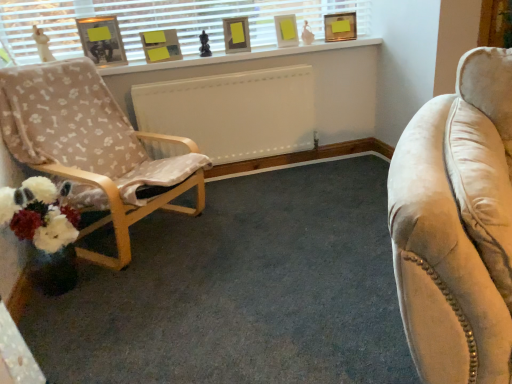
At what (x,y) coordinates should I click in order to perform the action: click on white matte window sill at upper center. Please return your answer as a coordinate pair (x, y). Image resolution: width=512 pixels, height=384 pixels. Looking at the image, I should click on (161, 22).

What do you see at coordinates (340, 27) in the screenshot?
I see `matte gold picture frame at upper center, positioned as the first picture frame in right-to-left order` at bounding box center [340, 27].

In order to click on matte gold picture frame at upper center, positioned as the first picture frame in right-to-left order in this screenshot , I will do tap(340, 27).

You are a GUI agent. You are given a task and a screenshot of the screen. Output one action in this format:
    pyautogui.click(x=<x>, y=<y>)
    Task: Click on the white painted wood at upper center
    The height and width of the screenshot is (384, 512).
    Given the screenshot: What is the action you would take?
    pyautogui.click(x=237, y=56)

Locate an element on the screen. Image resolution: width=512 pixels, height=384 pixels. matte black picture frame at upper left, the fifth picture frame in the right-to-left sequence is located at coordinates (102, 40).

Locate an element on the screen. Image resolution: width=512 pixels, height=384 pixels. white matte window sill at upper center is located at coordinates (161, 22).

From a real-world perspective, between matte gold picture frame at upper center, acting as the 5th picture frame starting from the left, and white matte window sill at upper center, who is vertically lower?

In real-world perspective, matte gold picture frame at upper center, acting as the 5th picture frame starting from the left, is lower.

Between point (334, 35) and point (47, 1), which one is positioned in front?

The point (47, 1) is more forward.

From the image's perspective, is matte gold picture frame at upper center, acting as the 5th picture frame starting from the left, over white matte window sill at upper center?

Yes, from the image's perspective, matte gold picture frame at upper center, acting as the 5th picture frame starting from the left, is over white matte window sill at upper center.

Is matte gold picture frame at upper center, acting as the 5th picture frame starting from the left, facing towards white matte window sill at upper center?

No, matte gold picture frame at upper center, acting as the 5th picture frame starting from the left, does not turn towards white matte window sill at upper center.

Considering the sizes of objects white painted wood at upper center and matte white picture frame at upper center, arranged as the second picture frame when viewed from the right, in the image provided, who is bigger, white painted wood at upper center or matte white picture frame at upper center, arranged as the second picture frame when viewed from the right,?

white painted wood at upper center is bigger.

Is white painted wood at upper center closer to camera compared to matte white picture frame at upper center, arranged as the second picture frame when viewed from the right?

Yes, white painted wood at upper center is closer to the camera.

From a real-world perspective, is white painted wood at upper center physically located above or below matte white picture frame at upper center, marked as the 4th picture frame in a left-to-right arrangement?

In terms of real-world spatial position, white painted wood at upper center is below matte white picture frame at upper center, marked as the 4th picture frame in a left-to-right arrangement.

You are a GUI agent. You are given a task and a screenshot of the screen. Output one action in this format:
    pyautogui.click(x=<x>, y=<y>)
    Task: Click on the window sill in front of the matte white picture frame at upper center, marked as the 4th picture frame in a left-to-right arrangement
    This screenshot has width=512, height=384.
    Given the screenshot: What is the action you would take?
    pyautogui.click(x=237, y=56)

How different are the orientations of white painted wood at upper center and matte gray picture frame at upper center, which is counted as the 3th picture frame, starting from the right, in degrees?

17.3 degrees.

Which is behind, white painted wood at upper center or matte gray picture frame at upper center, acting as the 3th picture frame starting from the left?

matte gray picture frame at upper center, acting as the 3th picture frame starting from the left, is behind.

Considering the points (374, 40) and (229, 22), which point is in front, point (374, 40) or point (229, 22)?

The point (229, 22) is closer to the camera.

Is white painted wood at upper center touching matte gray picture frame at upper center, acting as the 3th picture frame starting from the left?

No, white painted wood at upper center is not touching matte gray picture frame at upper center, acting as the 3th picture frame starting from the left.

In the scene shown: Can you tell me how much matte black picture frame at upper left, the first picture frame in the left-to-right sequence, and matte gray picture frame at upper center, acting as the 3th picture frame starting from the left, differ in facing direction?

matte black picture frame at upper left, the first picture frame in the left-to-right sequence, and matte gray picture frame at upper center, acting as the 3th picture frame starting from the left, are facing 25.1 degrees away from each other.

Would you consider matte black picture frame at upper left, the fifth picture frame in the right-to-left sequence, to be distant from matte gray picture frame at upper center, acting as the 3th picture frame starting from the left?

That's not correct — matte black picture frame at upper left, the fifth picture frame in the right-to-left sequence, is a little close to matte gray picture frame at upper center, acting as the 3th picture frame starting from the left.

Between matte black picture frame at upper left, the fifth picture frame in the right-to-left sequence, and matte gray picture frame at upper center, acting as the 3th picture frame starting from the left, which one has smaller width?

With smaller width is matte gray picture frame at upper center, acting as the 3th picture frame starting from the left.

There is a matte gray picture frame at upper center, which is counted as the 3th picture frame, starting from the right. At what (x,y) coordinates should I click in order to perform the action: click on picture frame above it (from a real-world perspective). Please return your answer as a coordinate pair (x, y). This screenshot has height=384, width=512. Looking at the image, I should click on (102, 40).

Is matte gold picture frame at upper center, acting as the 5th picture frame starting from the left, inside or outside of wooden chair with bone-patterned fabric at left?

matte gold picture frame at upper center, acting as the 5th picture frame starting from the left, is not inside wooden chair with bone-patterned fabric at left, it's outside.

Considering the positions of objects matte gold picture frame at upper center, positioned as the first picture frame in right-to-left order, and wooden chair with bone-patterned fabric at left in the image provided, who is in front, matte gold picture frame at upper center, positioned as the first picture frame in right-to-left order, or wooden chair with bone-patterned fabric at left?

wooden chair with bone-patterned fabric at left.

Which is in front, point (328, 36) or point (170, 167)?

Positioned in front is point (170, 167).

From the image's perspective, which is above, matte gold picture frame at upper center, acting as the 5th picture frame starting from the left, or wooden chair with bone-patterned fabric at left?

matte gold picture frame at upper center, acting as the 5th picture frame starting from the left, appears higher in the image.

Considering their positions, is wooden chair with bone-patterned fabric at left located in front of or behind matte black picture frame at upper left, the fifth picture frame in the right-to-left sequence?

In the image, wooden chair with bone-patterned fabric at left appears in front of matte black picture frame at upper left, the fifth picture frame in the right-to-left sequence.

The height and width of the screenshot is (384, 512). I want to click on chair below the matte black picture frame at upper left, the first picture frame in the left-to-right sequence (from a real-world perspective), so click(x=93, y=148).

Is wooden chair with bone-patterned fabric at left not inside matte black picture frame at upper left, the fifth picture frame in the right-to-left sequence?

Indeed, wooden chair with bone-patterned fabric at left is completely outside matte black picture frame at upper left, the fifth picture frame in the right-to-left sequence.

In the scene shown: From a real-world perspective, is wooden chair with bone-patterned fabric at left positioned over matte black picture frame at upper left, the first picture frame in the left-to-right sequence, based on gravity?

Actually, wooden chair with bone-patterned fabric at left is physically below matte black picture frame at upper left, the first picture frame in the left-to-right sequence, in the real world.

Find the location of `the 2nd picture frame counting from the right of the white painted wood at upper center`. the 2nd picture frame counting from the right of the white painted wood at upper center is located at coordinates [340, 27].

Which of these two, white painted wood at upper center or matte gold picture frame at upper center, positioned as the first picture frame in right-to-left order, stands taller?

Standing taller between the two is matte gold picture frame at upper center, positioned as the first picture frame in right-to-left order.

Measure the distance between white painted wood at upper center and matte gold picture frame at upper center, acting as the 5th picture frame starting from the left.

They are 14.11 inches apart.

Is white painted wood at upper center touching matte gold picture frame at upper center, acting as the 5th picture frame starting from the left?

No, white painted wood at upper center is not making contact with matte gold picture frame at upper center, acting as the 5th picture frame starting from the left.

In order to click on window lying in front of the matte gold picture frame at upper center, acting as the 5th picture frame starting from the left in this screenshot , I will do `click(161, 22)`.

Where is `window sill located below the matte white picture frame at upper center, marked as the 4th picture frame in a left-to-right arrangement (from the image's perspective)`? Image resolution: width=512 pixels, height=384 pixels. window sill located below the matte white picture frame at upper center, marked as the 4th picture frame in a left-to-right arrangement (from the image's perspective) is located at coordinates (237, 56).

Considering their positions, is matte gray picture frame at upper center, which is counted as the 3th picture frame, starting from the right, positioned further to matte black picture frame at upper left, the first picture frame in the left-to-right sequence, than matte cardboard picture frame at upper center, arranged as the second picture frame when viewed from the left?

Based on the image, matte gray picture frame at upper center, which is counted as the 3th picture frame, starting from the right, appears to be further to matte black picture frame at upper left, the first picture frame in the left-to-right sequence.

Considering their positions, is matte gray picture frame at upper center, which is counted as the 3th picture frame, starting from the right, positioned closer to matte black picture frame at upper left, the fifth picture frame in the right-to-left sequence, than white painted wood at upper center?

Based on the image, white painted wood at upper center appears to be nearer to matte black picture frame at upper left, the fifth picture frame in the right-to-left sequence.

Based on their spatial positions, is wooden chair with bone-patterned fabric at left or white painted wood at upper center closer to matte white picture frame at upper center, marked as the 4th picture frame in a left-to-right arrangement?

The object closer to matte white picture frame at upper center, marked as the 4th picture frame in a left-to-right arrangement, is white painted wood at upper center.

When comparing their distances from wooden chair with bone-patterned fabric at left, does matte gold picture frame at upper center, acting as the 5th picture frame starting from the left, or white painted wood at upper center seem further?

matte gold picture frame at upper center, acting as the 5th picture frame starting from the left, is positioned further to the anchor wooden chair with bone-patterned fabric at left.

When comparing their distances from matte black picture frame at upper left, the first picture frame in the left-to-right sequence, does white painted wood at upper center or matte gray picture frame at upper center, which is counted as the 3th picture frame, starting from the right, seem further?

matte gray picture frame at upper center, which is counted as the 3th picture frame, starting from the right, lies further to matte black picture frame at upper left, the first picture frame in the left-to-right sequence, than the other object.

When comparing their distances from matte black picture frame at upper left, the fifth picture frame in the right-to-left sequence, does matte gold picture frame at upper center, positioned as the first picture frame in right-to-left order, or white matte window sill at upper center seem closer?

The object closer to matte black picture frame at upper left, the fifth picture frame in the right-to-left sequence, is white matte window sill at upper center.

From the image, which object appears to be farther from white matte window sill at upper center, matte black picture frame at upper left, the first picture frame in the left-to-right sequence, or matte gold picture frame at upper center, acting as the 5th picture frame starting from the left?

Based on the image, matte gold picture frame at upper center, acting as the 5th picture frame starting from the left, appears to be further to white matte window sill at upper center.

When comparing their distances from matte black picture frame at upper left, the first picture frame in the left-to-right sequence, does matte white picture frame at upper center, arranged as the second picture frame when viewed from the right, or white painted wood at upper center seem further?

matte white picture frame at upper center, arranged as the second picture frame when viewed from the right.

The image size is (512, 384). Find the location of `window between wooden chair with bone-patterned fabric at left and matte gold picture frame at upper center, positioned as the first picture frame in right-to-left order, in the front-back direction`. window between wooden chair with bone-patterned fabric at left and matte gold picture frame at upper center, positioned as the first picture frame in right-to-left order, in the front-back direction is located at coordinates (161, 22).

Where is `window sill between matte cardboard picture frame at upper center, arranged as the second picture frame when viewed from the left, and matte white picture frame at upper center, marked as the 4th picture frame in a left-to-right arrangement`? The height and width of the screenshot is (384, 512). window sill between matte cardboard picture frame at upper center, arranged as the second picture frame when viewed from the left, and matte white picture frame at upper center, marked as the 4th picture frame in a left-to-right arrangement is located at coordinates (237, 56).

Locate an element on the screen. The width and height of the screenshot is (512, 384). window located between wooden chair with bone-patterned fabric at left and matte cardboard picture frame at upper center, the 4th picture frame from the right, in the depth direction is located at coordinates pos(161,22).

The image size is (512, 384). Find the location of `window situated between matte cardboard picture frame at upper center, arranged as the second picture frame when viewed from the left, and white painted wood at upper center from left to right`. window situated between matte cardboard picture frame at upper center, arranged as the second picture frame when viewed from the left, and white painted wood at upper center from left to right is located at coordinates (161, 22).